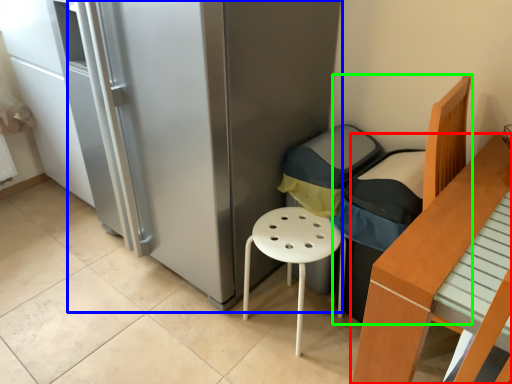
Question: Which is farther away from furniture (highlighted by a red box)? fridge (highlighted by a blue box) or armchair (highlighted by a green box)?

Choices:
 (A) fridge
 (B) armchair

Answer: (A)